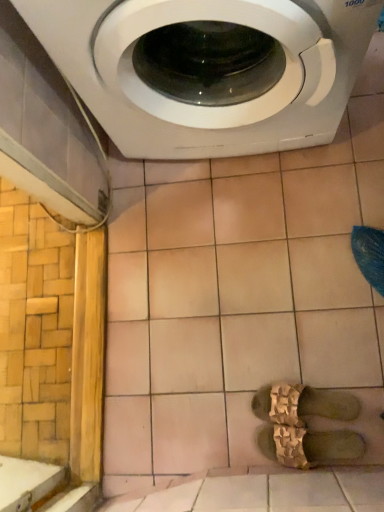
Locate an element on the screen. The image size is (384, 512). unoccupied area behind gold textured sandals at center, the first shoe when ordered from top to bottom is located at coordinates (264, 342).